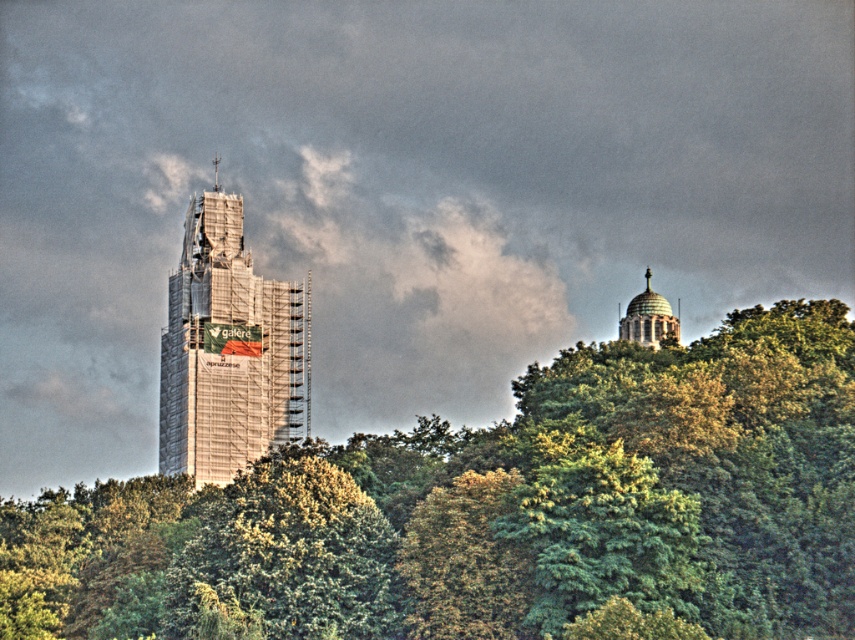
Question: Which point is farther from the camera taking this photo?

Choices:
 (A) (274, 589)
 (B) (656, 321)

Answer: (B)

Question: Among these objects, which one is farthest from the camera?

Choices:
 (A) green domed structure at upper right
 (B) scaffolding metal tower at center

Answer: (B)

Question: Which of the following is the farthest from the observer?

Choices:
 (A) (228, 468)
 (B) (635, 321)
 (C) (52, 620)

Answer: (B)

Question: Can you confirm if green leafy tree at center is smaller than green domed structure at upper right?

Choices:
 (A) yes
 (B) no

Answer: (B)

Question: Can you confirm if green leafy tree at center is positioned above scaffolding metal tower at center?

Choices:
 (A) no
 (B) yes

Answer: (A)

Question: Does green leafy tree at center appear under scaffolding metal tower at center?

Choices:
 (A) yes
 (B) no

Answer: (A)